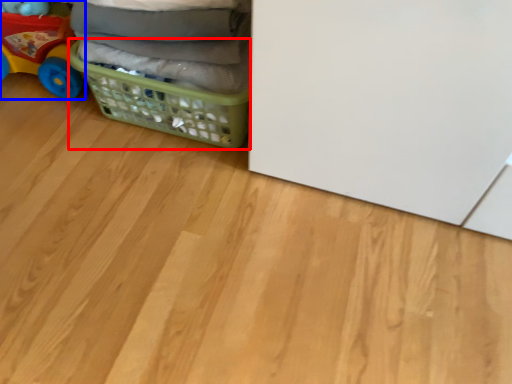
Question: Among these objects, which one is farthest to the camera, basket (highlighted by a red box) or toy (highlighted by a blue box)?

Choices:
 (A) basket
 (B) toy

Answer: (B)